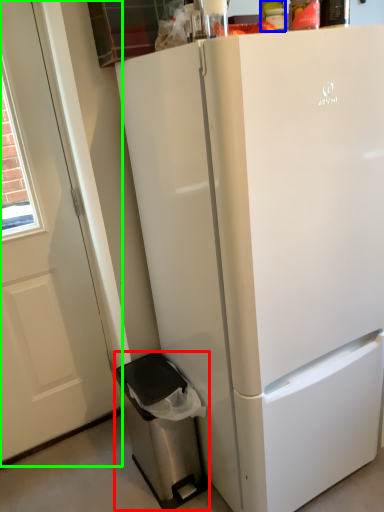
Question: Which object is positioned farthest from dish washer (highlighted by a red box)? Select from bottle (highlighted by a blue box) and screen door (highlighted by a green box).

Choices:
 (A) bottle
 (B) screen door

Answer: (A)